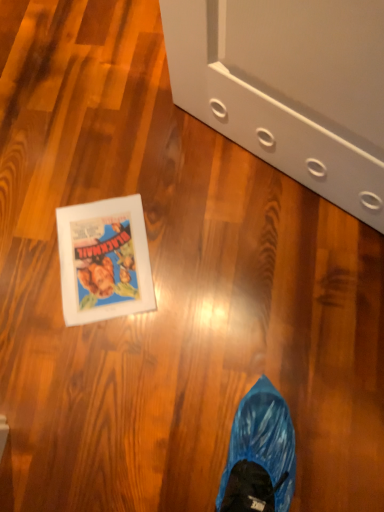
Describe the element at coordinates (104, 260) in the screenshot. The height and width of the screenshot is (512, 384). I see `matte paper comic book at lower left` at that location.

This screenshot has height=512, width=384. Find the location of `matte paper comic book at lower left`. matte paper comic book at lower left is located at coordinates (104, 260).

In order to face matte paper comic book at lower left, should I rotate leftwards or rightwards?

A 11.475 degree turn to the left will do.

Locate an element on the screen. The height and width of the screenshot is (512, 384). matte paper comic book at lower left is located at coordinates (104, 260).